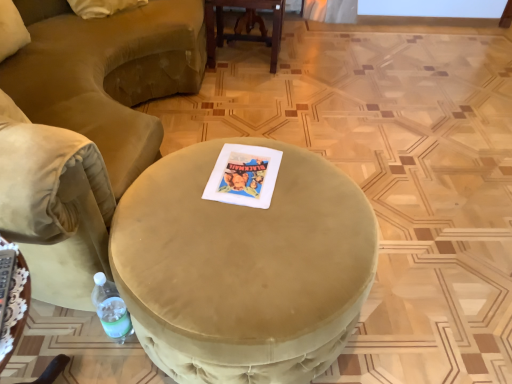
Question: Is suede-like beige ottoman at center to the right of translucent plastic bottle at lower left from the viewer's perspective?

Choices:
 (A) no
 (B) yes

Answer: (B)

Question: Does suede-like beige ottoman at center have a lesser width compared to translucent plastic bottle at lower left?

Choices:
 (A) yes
 (B) no

Answer: (B)

Question: From the image's perspective, is suede-like beige ottoman at center under translucent plastic bottle at lower left?

Choices:
 (A) yes
 (B) no

Answer: (B)

Question: Is the position of suede-like beige ottoman at center less distant than that of translucent plastic bottle at lower left?

Choices:
 (A) no
 (B) yes

Answer: (B)

Question: Can you confirm if suede-like beige ottoman at center is bigger than translucent plastic bottle at lower left?

Choices:
 (A) yes
 (B) no

Answer: (A)

Question: Is suede-like beige ottoman at center next to translucent plastic bottle at lower left and touching it?

Choices:
 (A) yes
 (B) no

Answer: (B)

Question: From the image's perspective, is satin beige ottoman at center, the first table viewed from the front, under wooden table at center, the second table from the left?

Choices:
 (A) no
 (B) yes

Answer: (B)

Question: From a real-world perspective, is satin beige ottoman at center, which is the 1th table from bottom to top, under wooden table at center, the 1th table in the top-to-bottom sequence?

Choices:
 (A) no
 (B) yes

Answer: (A)

Question: Is satin beige ottoman at center, arranged as the first table when viewed from the left, positioned far away from wooden table at center, the 1th table viewed from the right?

Choices:
 (A) yes
 (B) no

Answer: (A)

Question: Would you say satin beige ottoman at center, marked as the second table in a back-to-front arrangement, is outside wooden table at center, which is the 1th table in back-to-front order?

Choices:
 (A) no
 (B) yes

Answer: (B)

Question: Is satin beige ottoman at center, the first table viewed from the front, shorter than wooden table at center, the 1th table in the top-to-bottom sequence?

Choices:
 (A) no
 (B) yes

Answer: (B)

Question: Does satin beige ottoman at center, marked as the second table in a back-to-front arrangement, have a lesser width compared to wooden table at center, the second table ordered from the bottom?

Choices:
 (A) no
 (B) yes

Answer: (B)

Question: From a real-world perspective, is velvet beige chair at lower left positioned under satin beige ottoman at center, the second table positioned from the right, based on gravity?

Choices:
 (A) yes
 (B) no

Answer: (A)